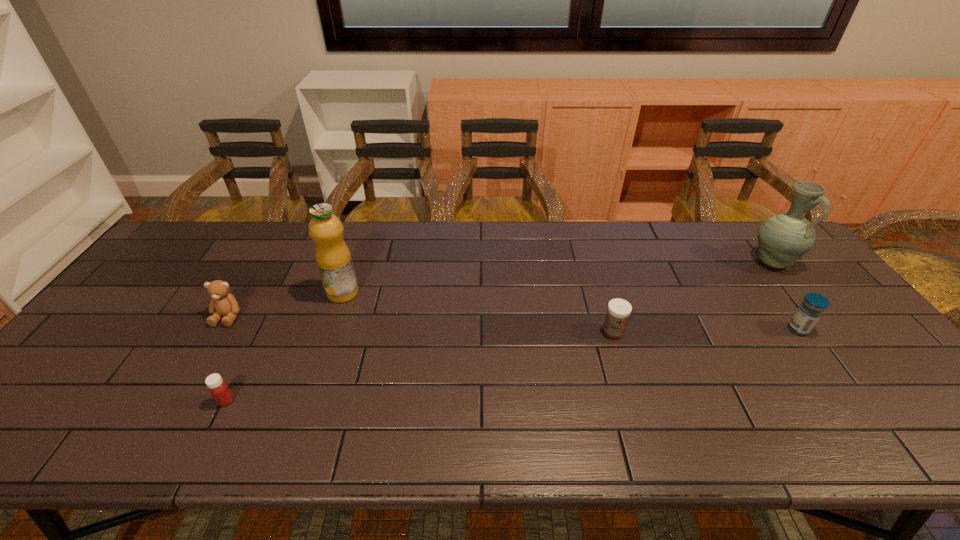
Where is `blank area in the image that satisfies the following two spatial constraints: 1. on the front label of the rightmost medicine; 2. on the left side of the fruit juice`? This screenshot has height=540, width=960. blank area in the image that satisfies the following two spatial constraints: 1. on the front label of the rightmost medicine; 2. on the left side of the fruit juice is located at coordinates (330, 329).

Identify the location of vacant space that satisfies the following two spatial constraints: 1. on the front-facing side of the leftmost object; 2. on the left side of the fourth object from left to right. (219, 331).